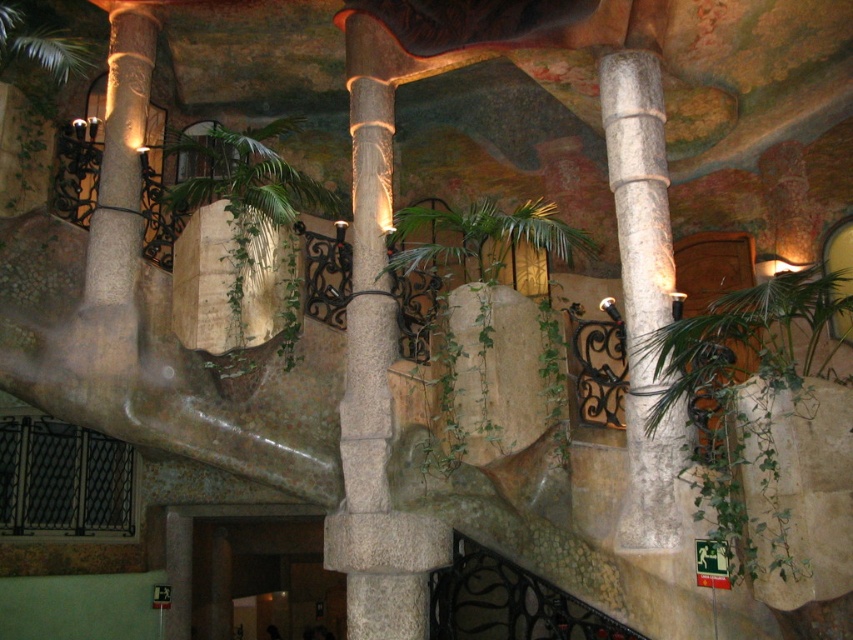
Which is behind, point (500, 362) or point (613, 108)?

Positioned behind is point (613, 108).

Does green leafy plant at center appear on the left side of white marble column at right?

Correct, you'll find green leafy plant at center to the left of white marble column at right.

Measure the distance between point (x=479, y=284) and camera.

Point (x=479, y=284) is 6.73 meters away from camera.

Locate an element on the screen. The height and width of the screenshot is (640, 853). green leafy plant at center is located at coordinates (492, 321).

What do you see at coordinates (492, 321) in the screenshot? The width and height of the screenshot is (853, 640). I see `green leafy plant at center` at bounding box center [492, 321].

Looking at this image, is green leafy plant at center closer to camera compared to green leafy palm tree at center?

Yes, green leafy plant at center is in front of green leafy palm tree at center.

Which is in front, point (521, 387) or point (223, 209)?

Point (521, 387)

Find the location of a particular element. This screenshot has width=853, height=640. green leafy plant at center is located at coordinates (492, 321).

Can you confirm if white marble column at right is positioned to the left of green leafy palm tree at center?

Incorrect, white marble column at right is not on the left side of green leafy palm tree at center.

Can you confirm if white marble column at right is smaller than green leafy palm tree at center?

Indeed, white marble column at right has a smaller size compared to green leafy palm tree at center.

Does point (654, 518) come closer to viewer compared to point (287, 364)?

That is True.

This screenshot has width=853, height=640. Find the location of `white marble column at right`. white marble column at right is located at coordinates (642, 289).